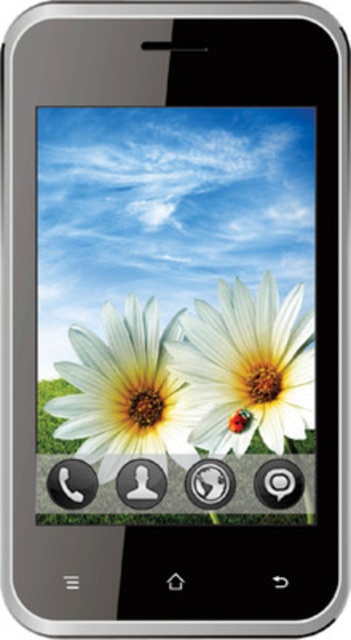
Question: Which object appears closest to the camera in this image?

Choices:
 (A) white matte flower at center
 (B) white matte daisy at center

Answer: (B)

Question: Does white matte flower at center have a smaller size compared to white matte daisy at center?

Choices:
 (A) no
 (B) yes

Answer: (B)

Question: Is white matte flower at center thinner than white matte daisy at center?

Choices:
 (A) no
 (B) yes

Answer: (B)

Question: Does white matte flower at center have a lesser width compared to white matte daisy at center?

Choices:
 (A) yes
 (B) no

Answer: (A)